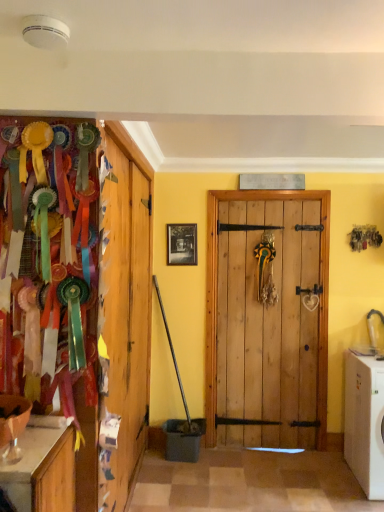
This screenshot has height=512, width=384. What do you see at coordinates (365, 422) in the screenshot?
I see `white plastic washing machine at lower right` at bounding box center [365, 422].

Identify the location of white plastic washing machine at lower right. (365, 422).

Identify the location of black matte picture frame at center. (182, 244).

What do you see at coordinates (182, 244) in the screenshot?
I see `black matte picture frame at center` at bounding box center [182, 244].

Find the location of a particular element. This screenshot has height=512, width=384. white plastic washing machine at lower right is located at coordinates (365, 422).

Between black matte picture frame at center and white plastic washing machine at lower right, which one appears on the right side from the viewer's perspective?

From the viewer's perspective, white plastic washing machine at lower right appears more on the right side.

Relative to white plastic washing machine at lower right, is black matte picture frame at center in front or behind?

black matte picture frame at center is behind white plastic washing machine at lower right.

Considering the positions of point (192, 259) and point (351, 385), is point (192, 259) closer or farther from the camera than point (351, 385)?

Point (192, 259) appears to be farther away from the viewer than point (351, 385).

From the image's perspective, is black matte picture frame at center located above white plastic washing machine at lower right?

Indeed, from the image's perspective, black matte picture frame at center is shown above white plastic washing machine at lower right.

From a real-world perspective, is black matte picture frame at center positioned above or below white plastic washing machine at lower right?

In terms of real-world spatial position, black matte picture frame at center is above white plastic washing machine at lower right.

Considering the sizes of black matte picture frame at center and white plastic washing machine at lower right in the image, is black matte picture frame at center wider or thinner than white plastic washing machine at lower right?

Clearly, black matte picture frame at center has less width compared to white plastic washing machine at lower right.

In the scene shown: Which of these two, black matte picture frame at center or white plastic washing machine at lower right, stands shorter?

black matte picture frame at center.

Which of these two, black matte picture frame at center or white plastic washing machine at lower right, is smaller?

black matte picture frame at center.

Is black matte picture frame at center not within white plastic washing machine at lower right?

Yes, black matte picture frame at center is not within white plastic washing machine at lower right.

Is black matte picture frame at center in contact with white plastic washing machine at lower right?

No, black matte picture frame at center is not making contact with white plastic washing machine at lower right.

Could you tell me if black matte picture frame at center is facing white plastic washing machine at lower right?

No, black matte picture frame at center is not turned towards white plastic washing machine at lower right.

How distant is black matte picture frame at center from white plastic washing machine at lower right?

The distance of black matte picture frame at center from white plastic washing machine at lower right is 5.24 feet.

Identify the location of picture frame on the left of white plastic washing machine at lower right. (182, 244).

Would you say white plastic washing machine at lower right is to the left or to the right of black matte picture frame at center in the picture?

white plastic washing machine at lower right is positioned on black matte picture frame at center's right side.

Is white plastic washing machine at lower right closer to the viewer compared to black matte picture frame at center?

Yes, white plastic washing machine at lower right is closer to the viewer.

Looking at this image, which is more distant, (x=349, y=403) or (x=171, y=228)?

Point (x=171, y=228)

From the image's perspective, does white plastic washing machine at lower right appear lower than black matte picture frame at center?

Yes.

From a real-world perspective, is white plastic washing machine at lower right positioned above or below black matte picture frame at center?

Clearly, from a real-world perspective, white plastic washing machine at lower right is below black matte picture frame at center.

Considering the relative sizes of white plastic washing machine at lower right and black matte picture frame at center in the image provided, is white plastic washing machine at lower right wider than black matte picture frame at center?

Indeed, white plastic washing machine at lower right has a greater width compared to black matte picture frame at center.

Between white plastic washing machine at lower right and black matte picture frame at center, which one has less height?

Standing shorter between the two is black matte picture frame at center.

Considering the relative sizes of white plastic washing machine at lower right and black matte picture frame at center in the image provided, is white plastic washing machine at lower right smaller than black matte picture frame at center?

Actually, white plastic washing machine at lower right might be larger than black matte picture frame at center.

Is white plastic washing machine at lower right inside or outside of black matte picture frame at center?

white plastic washing machine at lower right is spatially situated outside black matte picture frame at center.

Is white plastic washing machine at lower right far from black matte picture frame at center?

Indeed, white plastic washing machine at lower right is not near black matte picture frame at center.

Is white plastic washing machine at lower right facing towards black matte picture frame at center?

No, white plastic washing machine at lower right is not turned towards black matte picture frame at center.

Locate an element on the screen. The height and width of the screenshot is (512, 384). washing machine in front of the black matte picture frame at center is located at coordinates (365, 422).

At what (x,y) coordinates should I click in order to perform the action: click on washing machine to the right of black matte picture frame at center. Please return your answer as a coordinate pair (x, y). The width and height of the screenshot is (384, 512). Looking at the image, I should click on (365, 422).

The image size is (384, 512). What are the coordinates of `picture frame above the white plastic washing machine at lower right (from a real-world perspective)` in the screenshot? It's located at (182, 244).